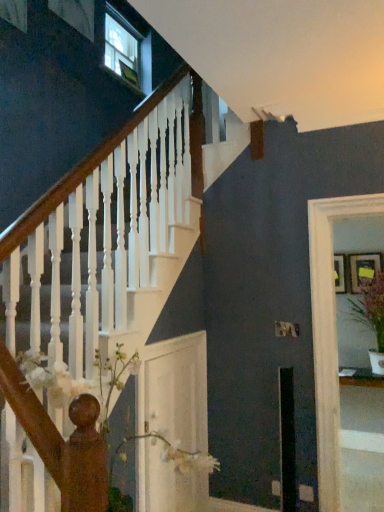
Where is `vacant point above white glossy door at center, the 2th glass door in the right-to-left sequence (from a real-world perspective)`? vacant point above white glossy door at center, the 2th glass door in the right-to-left sequence (from a real-world perspective) is located at coordinates (171, 339).